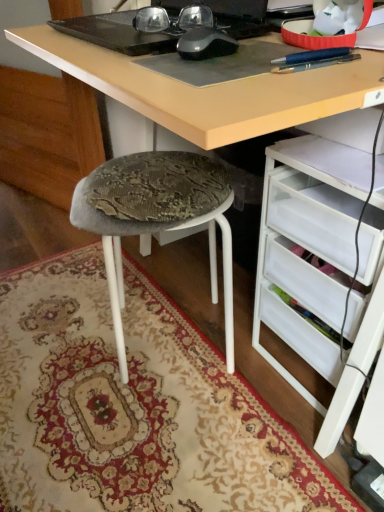
Question: Does matte black glasses at upper center have a lesser width compared to textured fabric stool at lower left?

Choices:
 (A) yes
 (B) no

Answer: (A)

Question: Does matte black glasses at upper center have a larger size compared to textured fabric stool at lower left?

Choices:
 (A) no
 (B) yes

Answer: (A)

Question: Can you confirm if matte black glasses at upper center is shorter than textured fabric stool at lower left?

Choices:
 (A) yes
 (B) no

Answer: (A)

Question: Is matte black glasses at upper center positioned with its back to textured fabric stool at lower left?

Choices:
 (A) yes
 (B) no

Answer: (B)

Question: Can you see matte black glasses at upper center touching textured fabric stool at lower left?

Choices:
 (A) yes
 (B) no

Answer: (B)

Question: Does point (215, 33) appear closer or farther from the camera than point (167, 215)?

Choices:
 (A) farther
 (B) closer

Answer: (B)

Question: Based on their sizes in the image, would you say black matte mouse at center is bigger or smaller than textured fabric stool at lower left?

Choices:
 (A) big
 (B) small

Answer: (B)

Question: Do you think black matte mouse at center is within textured fabric stool at lower left, or outside of it?

Choices:
 (A) inside
 (B) outside

Answer: (B)

Question: From the image's perspective, is black matte mouse at center located above or below textured fabric stool at lower left?

Choices:
 (A) below
 (B) above

Answer: (B)

Question: Considering the relative positions of textured fabric stool at lower left and matte black glasses at upper center in the image provided, is textured fabric stool at lower left to the left or to the right of matte black glasses at upper center?

Choices:
 (A) left
 (B) right

Answer: (A)

Question: Looking at their shapes, would you say textured fabric stool at lower left is wider or thinner than matte black glasses at upper center?

Choices:
 (A) wide
 (B) thin

Answer: (A)

Question: From a real-world perspective, is textured fabric stool at lower left above or below matte black glasses at upper center?

Choices:
 (A) above
 (B) below

Answer: (B)

Question: Considering their positions, is textured fabric stool at lower left located in front of or behind matte black glasses at upper center?

Choices:
 (A) front
 (B) behind

Answer: (B)

Question: Relative to white plastic drawers at lower right, is black matte mouse at center in front or behind?

Choices:
 (A) front
 (B) behind

Answer: (A)

Question: From a real-world perspective, is black matte mouse at center positioned above or below white plastic drawers at lower right?

Choices:
 (A) above
 (B) below

Answer: (A)